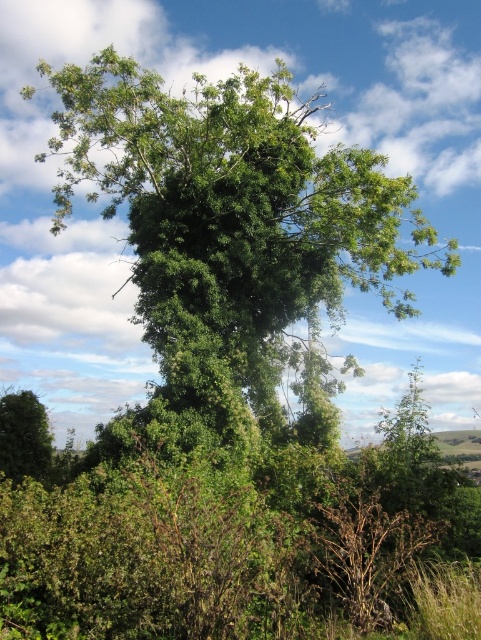
Is green leafy tree at center smaller than green leafy tree at lower left?

Incorrect, green leafy tree at center is not smaller in size than green leafy tree at lower left.

Is green leafy tree at center behind green leafy tree at lower left?

Yes, green leafy tree at center is behind green leafy tree at lower left.

Does point (109, 93) come behind point (50, 429)?

No, it is in front of (50, 429).

What are the coordinates of `green leafy tree at center` in the screenshot? It's located at (231, 216).